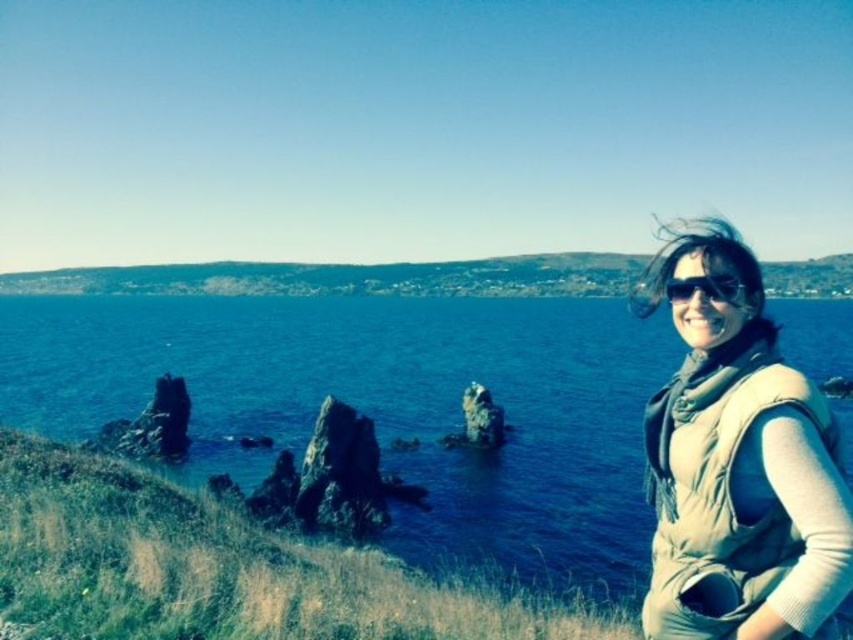
Question: Which object is the closest to the green grassy hillside at upper center?

Choices:
 (A) beige fabric scarf at right
 (B) matte black goggles at right
 (C) blue water at center

Answer: (C)

Question: Is the position of green grassy hillside at upper center more distant than that of matte black goggles at right?

Choices:
 (A) yes
 (B) no

Answer: (A)

Question: Can you confirm if green grassy hillside at upper center is wider than matte black goggles at right?

Choices:
 (A) yes
 (B) no

Answer: (A)

Question: Among these objects, which one is farthest from the camera?

Choices:
 (A) beige fabric scarf at right
 (B) green grassy hillside at upper center
 (C) blue water at center

Answer: (B)

Question: Which of the following is the farthest from the observer?

Choices:
 (A) beige fabric scarf at right
 (B) blue water at center
 (C) green grassy hillside at upper center
 (D) matte black goggles at right

Answer: (C)

Question: Can you confirm if blue water at center is wider than matte black goggles at right?

Choices:
 (A) no
 (B) yes

Answer: (B)